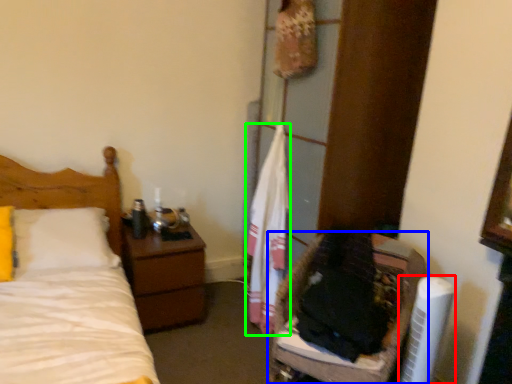
Question: Which object is positioned farthest from air conditioner (highlighted by a red box)? Select from furniture (highlighted by a blue box) and clothe (highlighted by a green box).

Choices:
 (A) furniture
 (B) clothe

Answer: (B)